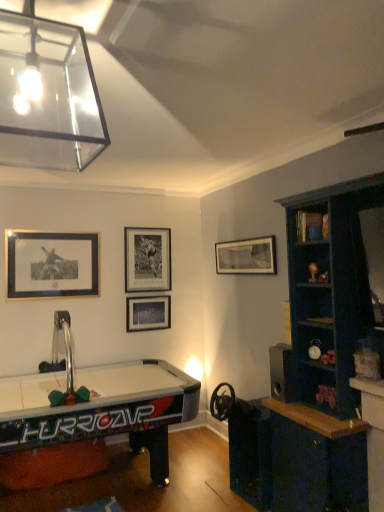
In order to face clear glass pendant light at upper left, should I rotate leftwards or rightwards?

Turn left approximately 17.904 degrees to face it.

What do you see at coordinates (47, 95) in the screenshot? I see `clear glass pendant light at upper left` at bounding box center [47, 95].

Identify the location of black matte picture frame at upper center, marked as the 1th picture frame in a right-to-left arrangement. tap(247, 256).

Find the location of a particular element. This screenshot has height=512, width=384. matte black picture frame at center, positioned as the second picture frame in right-to-left order is located at coordinates (148, 313).

What do you see at coordinates (148, 313) in the screenshot? The image size is (384, 512). I see `matte black picture frame at center, the third picture frame in the left-to-right sequence` at bounding box center [148, 313].

The width and height of the screenshot is (384, 512). Identify the location of gold metallic picture frame at upper left, marked as the 4th picture frame in a right-to-left arrangement. (52, 264).

Describe the element at coordinates (311, 226) in the screenshot. The image size is (384, 512). I see `wooden bookshelf at upper right` at that location.

How much space does black matte picture frame at upper center, the 3th picture frame viewed from the right, occupy horizontally?

black matte picture frame at upper center, the 3th picture frame viewed from the right, is 2.06 inches wide.

How much space does black matte picture frame at upper center, the second picture frame positioned from the left, occupy vertically?

It is 69.61 centimeters.

Measure the distance between point (21, 484) and camera.

Point (21, 484) and camera are 3.29 meters apart from each other.

At what (x,y) coordinates should I click in order to perform the action: click on clear glass pendant light at upper left. Please return your answer as a coordinate pair (x, y). This screenshot has height=512, width=384. Looking at the image, I should click on (47, 95).

From a real-world perspective, relative to wooden bookshelf at upper right, is matte black picture frame at center, the third picture frame in the left-to-right sequence, vertically above or below?

In terms of real-world spatial position, matte black picture frame at center, the third picture frame in the left-to-right sequence, is below wooden bookshelf at upper right.

From the image's perspective, is matte black picture frame at center, positioned as the second picture frame in right-to-left order, beneath wooden bookshelf at upper right?

Yes, from the image's perspective, matte black picture frame at center, positioned as the second picture frame in right-to-left order, is beneath wooden bookshelf at upper right.

In order to click on picture frame that is the 4th one when counting downward from the wooden bookshelf at upper right (from the image's perspective) in this screenshot , I will do `click(148, 313)`.

Considering the relative positions of matte black picture frame at center, the third picture frame in the left-to-right sequence, and metallic silver air hockey table at lower left in the image provided, is matte black picture frame at center, the third picture frame in the left-to-right sequence, to the right of metallic silver air hockey table at lower left from the viewer's perspective?

Correct, you'll find matte black picture frame at center, the third picture frame in the left-to-right sequence, to the right of metallic silver air hockey table at lower left.

Does point (155, 329) come farther from viewer compared to point (175, 373)?

Yes, it is.

From a real-world perspective, which object stands above the other?

matte black picture frame at center, positioned as the second picture frame in right-to-left order, from a real-world perspective.

Does matte black picture frame at center, the third picture frame in the left-to-right sequence, have a larger size compared to metallic silver air hockey table at lower left?

Actually, matte black picture frame at center, the third picture frame in the left-to-right sequence, might be smaller than metallic silver air hockey table at lower left.

Which is further, (240, 257) or (89, 250)?

Point (89, 250)

Considering the sizes of objects black matte picture frame at upper center, placed as the fourth picture frame when sorted from left to right, and gold metallic picture frame at upper left, marked as the 4th picture frame in a right-to-left arrangement, in the image provided, who is taller, black matte picture frame at upper center, placed as the fourth picture frame when sorted from left to right, or gold metallic picture frame at upper left, marked as the 4th picture frame in a right-to-left arrangement,?

With more height is gold metallic picture frame at upper left, marked as the 4th picture frame in a right-to-left arrangement.

Measure the distance between black matte picture frame at upper center, placed as the fourth picture frame when sorted from left to right, and gold metallic picture frame at upper left, the 1th picture frame from the left.

black matte picture frame at upper center, placed as the fourth picture frame when sorted from left to right, and gold metallic picture frame at upper left, the 1th picture frame from the left, are 5.36 feet apart.

Starting from the black matte picture frame at upper center, marked as the 1th picture frame in a right-to-left arrangement, which picture frame is the 3rd one to the left? Please provide its 2D coordinates.

[(52, 264)]

From the image's perspective, which object appears higher, black matte picture frame at upper center, the second picture frame positioned from the left, or clear glass pendant light at upper left?

From the image's view, clear glass pendant light at upper left is above.

Locate an element on the screen. The image size is (384, 512). lamp in front of the black matte picture frame at upper center, the 3th picture frame viewed from the right is located at coordinates (47, 95).

Considering the sizes of black matte picture frame at upper center, the second picture frame positioned from the left, and clear glass pendant light at upper left in the image, is black matte picture frame at upper center, the second picture frame positioned from the left, wider or thinner than clear glass pendant light at upper left?

In the image, black matte picture frame at upper center, the second picture frame positioned from the left, appears to be more narrow than clear glass pendant light at upper left.

Consider the image. Is black matte picture frame at upper center, the second picture frame positioned from the left, taller or shorter than clear glass pendant light at upper left?

Considering their sizes, black matte picture frame at upper center, the second picture frame positioned from the left, has more height than clear glass pendant light at upper left.

Is matte black picture frame at center, positioned as the second picture frame in right-to-left order, surrounding black matte picture frame at upper center, the 3th picture frame viewed from the right?

No, matte black picture frame at center, positioned as the second picture frame in right-to-left order, does not contain black matte picture frame at upper center, the 3th picture frame viewed from the right.

Measure the distance between matte black picture frame at center, the third picture frame in the left-to-right sequence, and black matte picture frame at upper center, the second picture frame positioned from the left.

A distance of 14.47 inches exists between matte black picture frame at center, the third picture frame in the left-to-right sequence, and black matte picture frame at upper center, the second picture frame positioned from the left.

Where is `the 1st picture frame in front of the black matte picture frame at upper center, the 3th picture frame viewed from the right, starting your count from the anchor`? The width and height of the screenshot is (384, 512). the 1st picture frame in front of the black matte picture frame at upper center, the 3th picture frame viewed from the right, starting your count from the anchor is located at coordinates [148, 313].

Is point (153, 307) farther from viewer compared to point (157, 289)?

That is False.

Is gold metallic picture frame at upper left, the 1th picture frame from the left, placed right next to black matte picture frame at upper center, placed as the fourth picture frame when sorted from left to right?

There is a gap between gold metallic picture frame at upper left, the 1th picture frame from the left, and black matte picture frame at upper center, placed as the fourth picture frame when sorted from left to right.

Is gold metallic picture frame at upper left, marked as the 4th picture frame in a right-to-left arrangement, facing towards black matte picture frame at upper center, marked as the 1th picture frame in a right-to-left arrangement?

No, gold metallic picture frame at upper left, marked as the 4th picture frame in a right-to-left arrangement, does not turn towards black matte picture frame at upper center, marked as the 1th picture frame in a right-to-left arrangement.

Measure the distance from gold metallic picture frame at upper left, the 1th picture frame from the left, to black matte picture frame at upper center, marked as the 1th picture frame in a right-to-left arrangement.

gold metallic picture frame at upper left, the 1th picture frame from the left, and black matte picture frame at upper center, marked as the 1th picture frame in a right-to-left arrangement, are 1.63 meters apart.

From the image's perspective, does gold metallic picture frame at upper left, the 1th picture frame from the left, appear higher than black matte picture frame at upper center, placed as the fourth picture frame when sorted from left to right?

Actually, gold metallic picture frame at upper left, the 1th picture frame from the left, appears below black matte picture frame at upper center, placed as the fourth picture frame when sorted from left to right, in the image.

Which object is closer to the camera, black matte picture frame at upper center, the second picture frame positioned from the left, or wooden bookshelf at upper right?

wooden bookshelf at upper right is more forward.

Is black matte picture frame at upper center, the 3th picture frame viewed from the right, shorter than wooden bookshelf at upper right?

In fact, black matte picture frame at upper center, the 3th picture frame viewed from the right, may be taller than wooden bookshelf at upper right.

Does black matte picture frame at upper center, the second picture frame positioned from the left, turn towards wooden bookshelf at upper right?

Yes, black matte picture frame at upper center, the second picture frame positioned from the left, faces towards wooden bookshelf at upper right.

At what (x,y) coordinates should I click in order to perform the action: click on cabinet in front of the matte black picture frame at center, the third picture frame in the left-to-right sequence. Please return your answer as a coordinate pair (x, y). Looking at the image, I should click on (311, 226).

The width and height of the screenshot is (384, 512). I want to click on the 1st picture frame above the metallic silver air hockey table at lower left (from the image's perspective), so click(148, 313).

Based on their spatial positions, is black matte picture frame at upper center, the second picture frame positioned from the left, or wooden bookshelf at upper right further from clear glass pendant light at upper left?

black matte picture frame at upper center, the second picture frame positioned from the left, lies further to clear glass pendant light at upper left than the other object.

Estimate the real-world distances between objects in this image. Which object is closer to metallic silver air hockey table at lower left, clear glass pendant light at upper left or matte black picture frame at center, the third picture frame in the left-to-right sequence?

matte black picture frame at center, the third picture frame in the left-to-right sequence, lies closer to metallic silver air hockey table at lower left than the other object.

Looking at the image, which one is located further to black matte picture frame at upper center, the 3th picture frame viewed from the right, metallic silver air hockey table at lower left or gold metallic picture frame at upper left, the 1th picture frame from the left?

The object further to black matte picture frame at upper center, the 3th picture frame viewed from the right, is metallic silver air hockey table at lower left.

Based on their spatial positions, is gold metallic picture frame at upper left, the 1th picture frame from the left, or metallic silver air hockey table at lower left closer to wooden bookshelf at upper right?

Based on the image, metallic silver air hockey table at lower left appears to be nearer to wooden bookshelf at upper right.

Looking at the image, which one is located further to clear glass pendant light at upper left, metallic silver air hockey table at lower left or black matte picture frame at upper center, the 3th picture frame viewed from the right?

black matte picture frame at upper center, the 3th picture frame viewed from the right, is positioned further to the anchor clear glass pendant light at upper left.

Which object lies nearer to the anchor point metallic silver air hockey table at lower left, black matte picture frame at upper center, the second picture frame positioned from the left, or black matte picture frame at upper center, marked as the 1th picture frame in a right-to-left arrangement?

The object closer to metallic silver air hockey table at lower left is black matte picture frame at upper center, the second picture frame positioned from the left.

Which object lies further to the anchor point clear glass pendant light at upper left, gold metallic picture frame at upper left, marked as the 4th picture frame in a right-to-left arrangement, or matte black picture frame at center, positioned as the second picture frame in right-to-left order?

The object further to clear glass pendant light at upper left is matte black picture frame at center, positioned as the second picture frame in right-to-left order.

Which object lies further to the anchor point black matte picture frame at upper center, placed as the fourth picture frame when sorted from left to right, matte black picture frame at center, positioned as the second picture frame in right-to-left order, or black matte picture frame at upper center, the 3th picture frame viewed from the right?

matte black picture frame at center, positioned as the second picture frame in right-to-left order, is positioned further to the anchor black matte picture frame at upper center, placed as the fourth picture frame when sorted from left to right.

The width and height of the screenshot is (384, 512). What are the coordinates of `cabinet between clear glass pendant light at upper left and black matte picture frame at upper center, placed as the fourth picture frame when sorted from left to right, from front to back` in the screenshot? It's located at (311, 226).

The width and height of the screenshot is (384, 512). In order to click on cabinet positioned between metallic silver air hockey table at lower left and matte black picture frame at center, the third picture frame in the left-to-right sequence, from near to far in this screenshot , I will do `click(311, 226)`.

Locate an element on the screen. desk between clear glass pendant light at upper left and gold metallic picture frame at upper left, the 1th picture frame from the left, in the front-back direction is located at coordinates (86, 418).

The width and height of the screenshot is (384, 512). I want to click on desk between gold metallic picture frame at upper left, marked as the 4th picture frame in a right-to-left arrangement, and black matte picture frame at upper center, marked as the 1th picture frame in a right-to-left arrangement, in the horizontal direction, so click(86, 418).